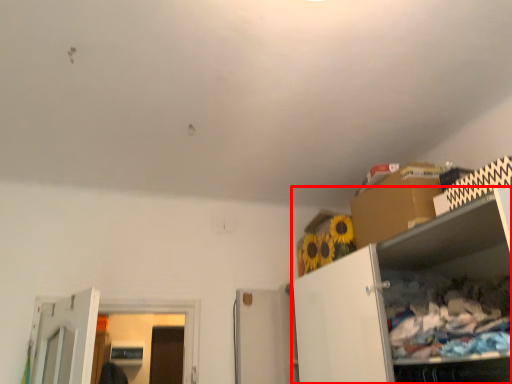
Question: From the image, what is the correct spatial relationship of cabinetry (annotated by the red box) in relation to cardboard box?

Choices:
 (A) right
 (B) left

Answer: (B)